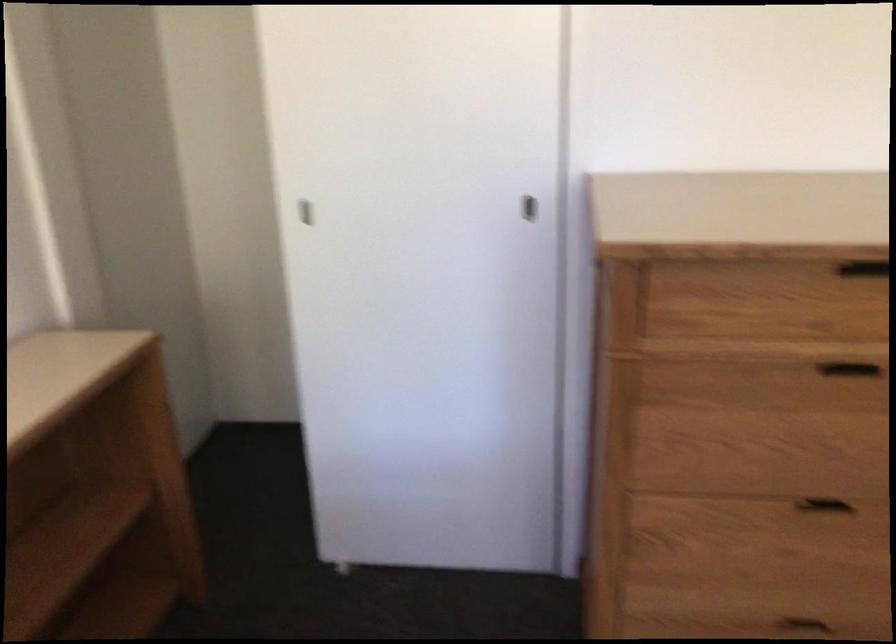
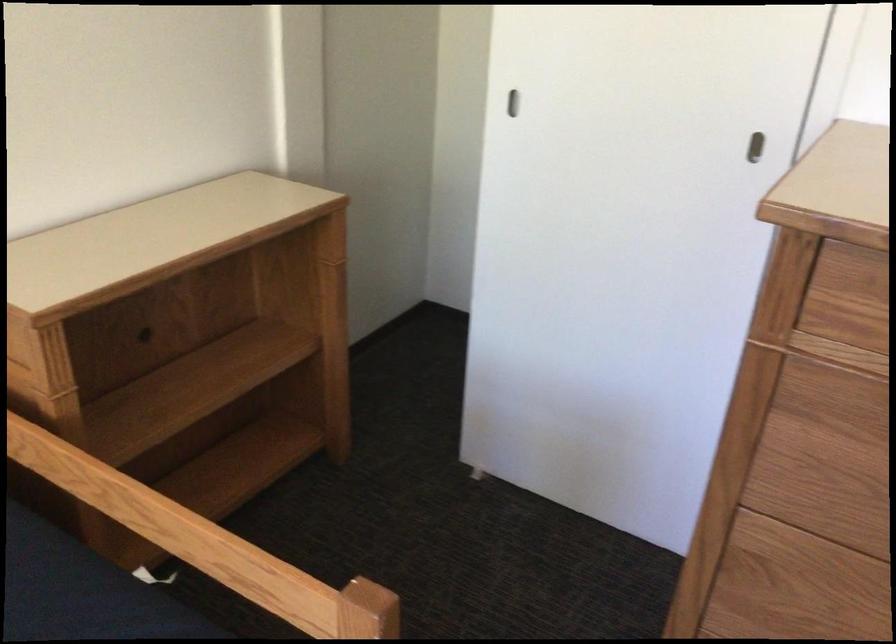
In the second image, find the point that corresponds to pixel 303 212 in the first image.

(512, 102)